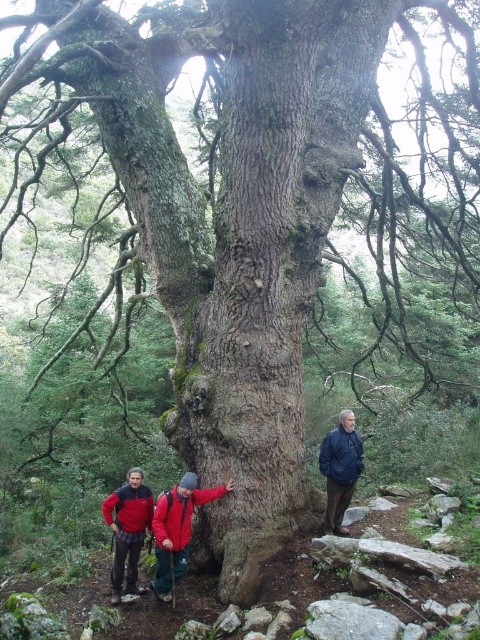
You are planning to place a 6.5 meter long wooden bench between the red fleece jacket at lower left and the other two hikers. Will the bench fit between them?

The distance between the red fleece jacket at lower left and the other two hikers is 6.47 meters, so the 6.5 meter long wooden bench will not fit between them as it is slightly longer than the available space.

You are one of the hikers standing in front of the ancient tree. You notice the red fleece jackets at lower center and the blue jacket at center. Which jacket is positioned lower in the image?

The red fleece jackets at lower center is located below the blue jacket at center, so it is positioned lower in the image.